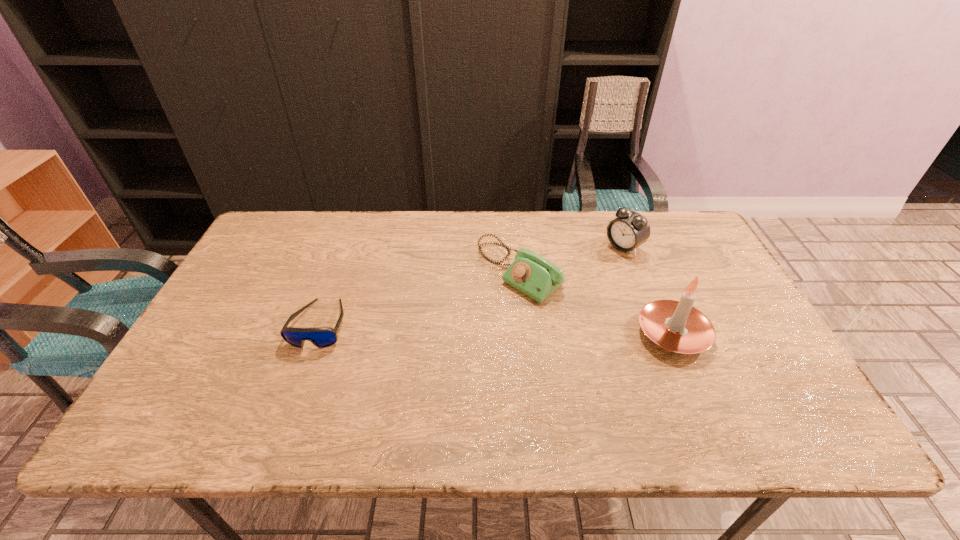
The height and width of the screenshot is (540, 960). Find the location of `blank area located 0.180m on the front side of the second tallest object`. blank area located 0.180m on the front side of the second tallest object is located at coordinates (576, 282).

I want to click on vacant space situated on the dial of the telephone, so click(x=388, y=374).

Image resolution: width=960 pixels, height=540 pixels. Identify the location of free space located 0.300m on the dial of the telephone. (408, 359).

Find the location of `free location located on the dial of the telephone`. free location located on the dial of the telephone is located at coordinates (385, 376).

Locate an element on the screen. alarm clock located at the far edge is located at coordinates (630, 229).

Locate an element on the screen. The image size is (960, 540). telephone that is positioned at the far edge is located at coordinates (530, 273).

The width and height of the screenshot is (960, 540). I want to click on object that is positioned at the right edge, so click(677, 326).

Find the location of `free space at the far edge of the desktop`. free space at the far edge of the desktop is located at coordinates (556, 230).

The height and width of the screenshot is (540, 960). In the image, there is a desktop. Find the location of `free region at the near edge`. free region at the near edge is located at coordinates (366, 402).

Locate an element on the screen. The width and height of the screenshot is (960, 540). free space at the left edge of the desktop is located at coordinates (266, 314).